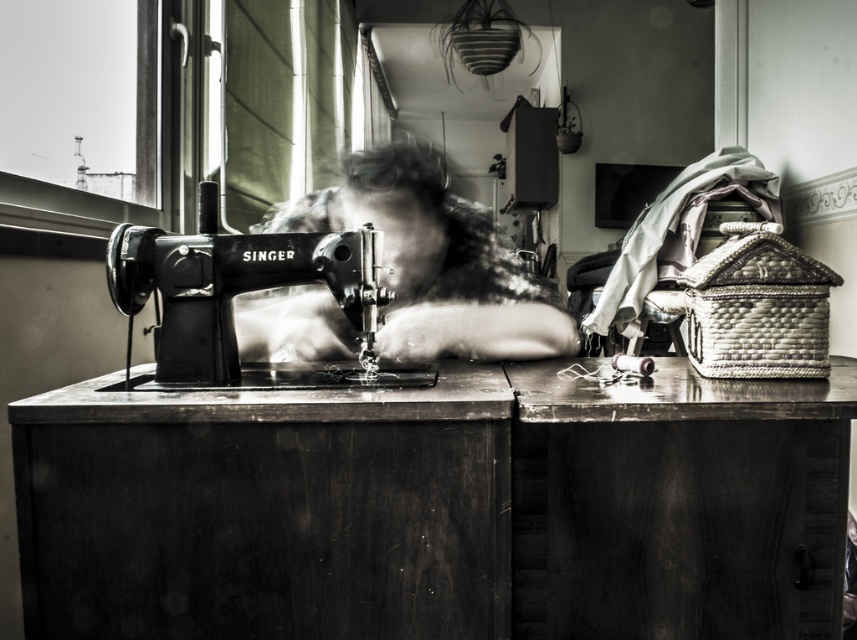
Question: Is smooth fabric woman at center smaller than metallic singer sewing machine at center?

Choices:
 (A) no
 (B) yes

Answer: (A)

Question: Among these objects, which one is nearest to the camera?

Choices:
 (A) smooth fabric woman at center
 (B) wooden table at lower right
 (C) metallic singer sewing machine at center

Answer: (B)

Question: Estimate the real-world distances between objects in this image. Which object is farther from the wooden table at lower right?

Choices:
 (A) smooth fabric woman at center
 (B) metallic singer sewing machine at center

Answer: (B)

Question: Which of these objects is positioned closest to the metallic singer sewing machine at center?

Choices:
 (A) wooden table at lower right
 (B) smooth fabric woman at center

Answer: (B)

Question: Can you confirm if wooden table at lower right is positioned above smooth fabric woman at center?

Choices:
 (A) no
 (B) yes

Answer: (A)

Question: Does smooth fabric woman at center appear on the left side of metallic singer sewing machine at center?

Choices:
 (A) yes
 (B) no

Answer: (B)